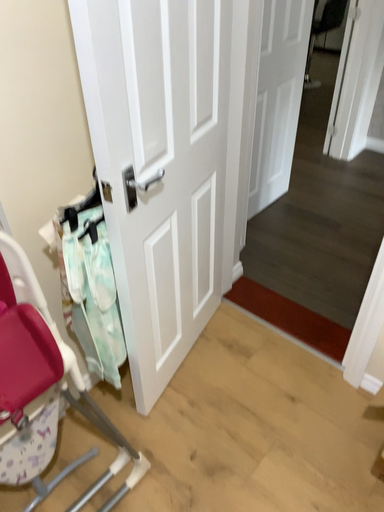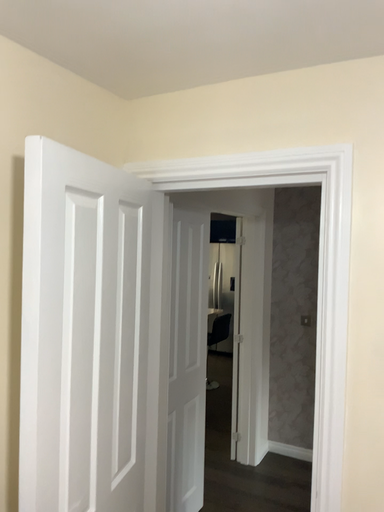
Question: Which way did the camera rotate in the video?

Choices:
 (A) rotated downward
 (B) rotated upward

Answer: (B)